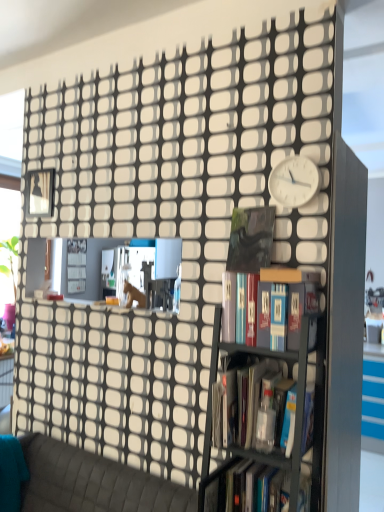
Question: Is there a large distance between white plastic clock at upper right and textured gray couch at lower left?

Choices:
 (A) no
 (B) yes

Answer: (B)

Question: Does white plastic clock at upper right have a greater width compared to textured gray couch at lower left?

Choices:
 (A) no
 (B) yes

Answer: (A)

Question: Does white plastic clock at upper right lie in front of textured gray couch at lower left?

Choices:
 (A) no
 (B) yes

Answer: (A)

Question: From the image's perspective, is white plastic clock at upper right below textured gray couch at lower left?

Choices:
 (A) no
 (B) yes

Answer: (A)

Question: Is white plastic clock at upper right facing towards textured gray couch at lower left?

Choices:
 (A) no
 (B) yes

Answer: (A)

Question: Would you say metallic gray bookcase at center is to the left or to the right of matte black book at upper center in the picture?

Choices:
 (A) right
 (B) left

Answer: (B)

Question: Considering the positions of metallic gray bookcase at center and matte black book at upper center in the image, is metallic gray bookcase at center taller or shorter than matte black book at upper center?

Choices:
 (A) short
 (B) tall

Answer: (B)

Question: Is metallic gray bookcase at center in front of or behind matte black book at upper center in the image?

Choices:
 (A) behind
 (B) front

Answer: (B)

Question: From a real-world perspective, is metallic gray bookcase at center positioned above or below matte black book at upper center?

Choices:
 (A) below
 (B) above

Answer: (A)

Question: Does point (253, 377) appear closer or farther from the camera than point (241, 392)?

Choices:
 (A) closer
 (B) farther

Answer: (B)

Question: Considering their positions, is metallic gray bookcase at center located in front of or behind translucent plastic bottle at center, acting as the second book starting from the bottom?

Choices:
 (A) behind
 (B) front

Answer: (B)

Question: From a real-world perspective, is metallic gray bookcase at center positioned above or below translucent plastic bottle at center, acting as the second book starting from the bottom?

Choices:
 (A) above
 (B) below

Answer: (B)

Question: Considering the positions of metallic gray bookcase at center and translucent plastic bottle at center, which appears as the 2th book when viewed from the top, in the image, is metallic gray bookcase at center taller or shorter than translucent plastic bottle at center, which appears as the 2th book when viewed from the top,?

Choices:
 (A) tall
 (B) short

Answer: (A)

Question: Considering the positions of matte black book at upper center and hardcover books at center, the first book viewed from the top, in the image, is matte black book at upper center taller or shorter than hardcover books at center, the first book viewed from the top,?

Choices:
 (A) tall
 (B) short

Answer: (A)

Question: Considering the positions of matte black book at upper center and hardcover books at center, the first book viewed from the top, in the image, is matte black book at upper center bigger or smaller than hardcover books at center, the first book viewed from the top,?

Choices:
 (A) small
 (B) big

Answer: (A)